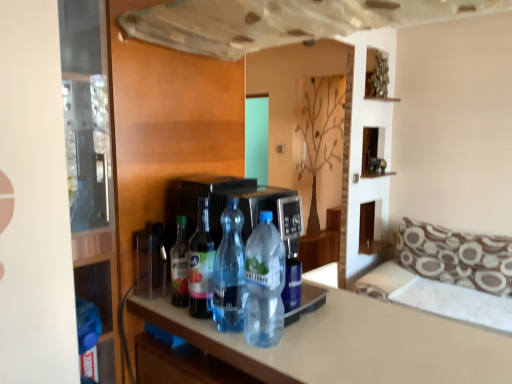
Where is `translucent plastic bottle at center, the first bottle positioned from the left`? Image resolution: width=512 pixels, height=384 pixels. translucent plastic bottle at center, the first bottle positioned from the left is located at coordinates (180, 265).

Image resolution: width=512 pixels, height=384 pixels. Identify the location of metallic silver sculpture at upper center. (377, 76).

What is the approximate height of white glossy countertop at center?

The height of white glossy countertop at center is 20.19 inches.

Describe the element at coordinates (447, 275) in the screenshot. I see `brown patterned fabric couch at right` at that location.

Describe the element at coordinates (456, 256) in the screenshot. The height and width of the screenshot is (384, 512). I see `brown printed fabric pillow at right` at that location.

This screenshot has width=512, height=384. Describe the element at coordinates (264, 284) in the screenshot. I see `clear plastic bottle at center, acting as the fourth bottle starting from the left` at that location.

I want to click on translucent plastic bottle at center, the first bottle positioned from the left, so click(180, 265).

Locate an element on the screen. Image resolution: width=512 pixels, height=384 pixels. shelf on the right of translucent plastic bottle at center, the fourth bottle in the right-to-left sequence is located at coordinates (377, 76).

Between translucent plastic bottle at center, the fourth bottle in the right-to-left sequence, and metallic silver sculpture at upper center, which one appears on the right side from the viewer's perspective?

Positioned to the right is metallic silver sculpture at upper center.

Could you tell me if translucent plastic bottle at center, the first bottle positioned from the left, is facing metallic silver sculpture at upper center?

No, translucent plastic bottle at center, the first bottle positioned from the left, does not turn towards metallic silver sculpture at upper center.

From the image's perspective, is translucent plastic bottle at center, the first bottle positioned from the left, beneath metallic silver sculpture at upper center?

Indeed, from the image's perspective, translucent plastic bottle at center, the first bottle positioned from the left, is shown beneath metallic silver sculpture at upper center.

From a real-world perspective, which is physically above, brown patterned fabric couch at right or transparent glass door at left?

transparent glass door at left is physically above.

Is brown patterned fabric couch at right oriented away from transparent glass door at left?

No.

Is brown patterned fabric couch at right at the left side of transparent glass door at left?

No.

Where is `couch below the transparent glass door at left (from a real-world perspective)`? couch below the transparent glass door at left (from a real-world perspective) is located at coordinates (447, 275).

From a real-world perspective, between transparent glass door at left and clear plastic bottle at center, which ranks as the 1th bottle in right-to-left order, who is vertically lower?

clear plastic bottle at center, which ranks as the 1th bottle in right-to-left order, is physically lower.

Between transparent glass door at left and clear plastic bottle at center, acting as the fourth bottle starting from the left, which one has larger width?

transparent glass door at left.

How different are the orientations of transparent glass door at left and clear plastic bottle at center, which ranks as the 1th bottle in right-to-left order, in degrees?

The angle between the facing direction of transparent glass door at left and the facing direction of clear plastic bottle at center, which ranks as the 1th bottle in right-to-left order, is 6.6 degrees.

Is brown printed fabric pillow at right located outside translucent plastic bottle at center, which is counted as the second bottle, starting from the left?

Indeed, brown printed fabric pillow at right is completely outside translucent plastic bottle at center, which is counted as the second bottle, starting from the left.

From a real-world perspective, is brown printed fabric pillow at right under translucent plastic bottle at center, which is counted as the second bottle, starting from the left?

Yes.

Identify the location of pillow below the translucent plastic bottle at center, which appears as the third bottle when viewed from the right (from a real-world perspective). (456, 256).

Is point (510, 241) positioned in front of point (204, 275)?

No, (510, 241) is further to viewer.

Does point (182, 215) come farther from viewer compared to point (238, 242)?

That is True.

Is translucent plastic bottle at center, the first bottle positioned from the left, located outside transparent plastic bottle at center, which is the 2th bottle in right-to-left order?

Absolutely, translucent plastic bottle at center, the first bottle positioned from the left, is external to transparent plastic bottle at center, which is the 2th bottle in right-to-left order.

From a real-world perspective, relative to transparent plastic bottle at center, which is the 2th bottle in right-to-left order, is translucent plastic bottle at center, the fourth bottle in the right-to-left sequence, vertically above or below?

In terms of real-world spatial position, translucent plastic bottle at center, the fourth bottle in the right-to-left sequence, is below transparent plastic bottle at center, which is the 2th bottle in right-to-left order.

Which object is closer to the camera, translucent plastic bottle at center, the first bottle positioned from the left, or transparent plastic bottle at center, which is the 2th bottle in right-to-left order?

Positioned in front is transparent plastic bottle at center, which is the 2th bottle in right-to-left order.

Can you confirm if brown printed fabric pillow at right is shorter than metallic silver sculpture at upper center?

In fact, brown printed fabric pillow at right may be taller than metallic silver sculpture at upper center.

Does brown printed fabric pillow at right have a greater width compared to metallic silver sculpture at upper center?

Correct, the width of brown printed fabric pillow at right exceeds that of metallic silver sculpture at upper center.

Can we say brown printed fabric pillow at right lies outside metallic silver sculpture at upper center?

Indeed, brown printed fabric pillow at right is completely outside metallic silver sculpture at upper center.

Relative to metallic silver sculpture at upper center, is brown printed fabric pillow at right in front or behind?

Visually, brown printed fabric pillow at right is located in front of metallic silver sculpture at upper center.

Can you confirm if brown printed fabric pillow at right is positioned to the right of white glossy countertop at center?

Correct, you'll find brown printed fabric pillow at right to the right of white glossy countertop at center.

Is brown printed fabric pillow at right looking in the opposite direction of white glossy countertop at center?

No, white glossy countertop at center is not at the back of brown printed fabric pillow at right.

Does brown printed fabric pillow at right lie behind white glossy countertop at center?

Yes, brown printed fabric pillow at right is behind white glossy countertop at center.

Is white glossy countertop at center located within brown printed fabric pillow at right?

That's incorrect, white glossy countertop at center is not inside brown printed fabric pillow at right.

This screenshot has width=512, height=384. I want to click on shelf behind the translucent plastic bottle at center, the fourth bottle in the right-to-left sequence, so click(377, 76).

Find the location of `couch that is under the transparent glass door at left (from a real-world perspective)`. couch that is under the transparent glass door at left (from a real-world perspective) is located at coordinates coord(447,275).

Which object lies further to the anchor point transparent glass door at left, translucent plastic bottle at center, which appears as the third bottle when viewed from the right, or clear plastic bottle at center, which ranks as the 1th bottle in right-to-left order?

Among the two, clear plastic bottle at center, which ranks as the 1th bottle in right-to-left order, is located further to transparent glass door at left.

Estimate the real-world distances between objects in this image. Which object is further from brown patterned fabric couch at right, clear plastic bottle at center, acting as the fourth bottle starting from the left, or transparent glass door at left?

transparent glass door at left.

Based on their spatial positions, is translucent plastic bottle at center, which appears as the third bottle when viewed from the right, or transparent plastic bottle at center, which is the 2th bottle in right-to-left order, closer to white glossy countertop at center?

Based on the image, transparent plastic bottle at center, which is the 2th bottle in right-to-left order, appears to be nearer to white glossy countertop at center.

Looking at the image, which one is located further to clear plastic bottle at center, acting as the fourth bottle starting from the left, transparent glass door at left or translucent plastic bottle at center, the fourth bottle in the right-to-left sequence?

Based on the image, transparent glass door at left appears to be further to clear plastic bottle at center, acting as the fourth bottle starting from the left.

Looking at this image, estimate the real-world distances between objects in this image. Which object is further from translucent plastic bottle at center, which is counted as the second bottle, starting from the left, white glossy countertop at center or brown printed fabric pillow at right?

brown printed fabric pillow at right is positioned further to the anchor translucent plastic bottle at center, which is counted as the second bottle, starting from the left.

From the image, which object appears to be nearer to transparent plastic bottle at center, which is the 2th bottle in right-to-left order, brown patterned fabric couch at right or brown printed fabric pillow at right?

brown patterned fabric couch at right is closer to transparent plastic bottle at center, which is the 2th bottle in right-to-left order.

Which object lies further to the anchor point metallic silver sculpture at upper center, transparent glass door at left or translucent plastic bottle at center, which appears as the third bottle when viewed from the right?

The object further to metallic silver sculpture at upper center is translucent plastic bottle at center, which appears as the third bottle when viewed from the right.

From the picture: From the image, which object appears to be farther from brown printed fabric pillow at right, brown patterned fabric couch at right or white glossy countertop at center?

white glossy countertop at center is further to brown printed fabric pillow at right.

Where is `couch between clear plastic bottle at center, which ranks as the 1th bottle in right-to-left order, and brown printed fabric pillow at right, along the z-axis`? couch between clear plastic bottle at center, which ranks as the 1th bottle in right-to-left order, and brown printed fabric pillow at right, along the z-axis is located at coordinates (447, 275).

I want to click on pillow between metallic silver sculpture at upper center and brown patterned fabric couch at right in the vertical direction, so click(x=456, y=256).

The image size is (512, 384). What are the coordinates of `couch between white glossy countertop at center and brown printed fabric pillow at right in the front-back direction` in the screenshot? It's located at (447, 275).

This screenshot has width=512, height=384. Find the location of `couch between transparent plastic bottle at center, which appears as the 3th bottle when viewed from the left, and brown printed fabric pillow at right from front to back`. couch between transparent plastic bottle at center, which appears as the 3th bottle when viewed from the left, and brown printed fabric pillow at right from front to back is located at coordinates (447, 275).